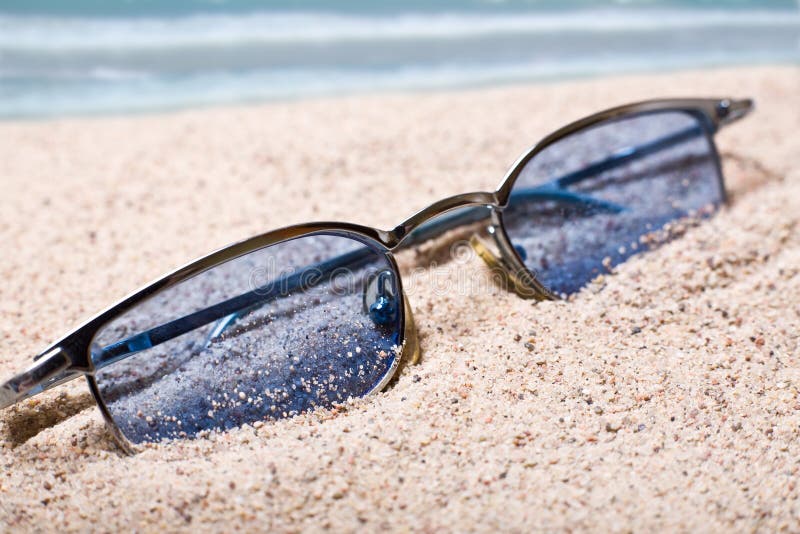
The image size is (800, 534). I want to click on hinges, so click(x=45, y=364), click(x=734, y=103).